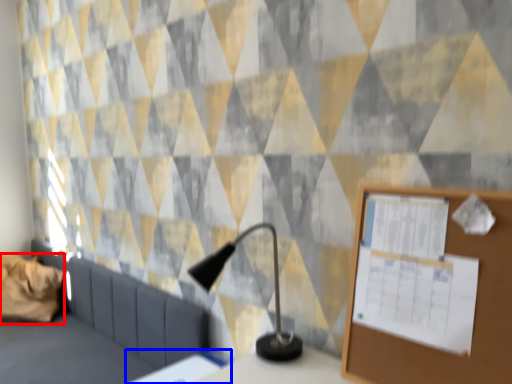
Question: Which of the following is the closest to the observer, pillow (highlighted by a red box) or table (highlighted by a blue box)?

Choices:
 (A) pillow
 (B) table

Answer: (B)